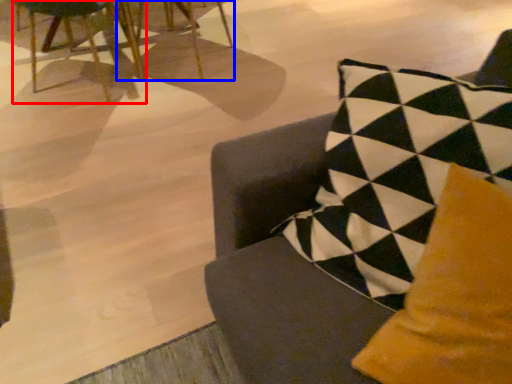
Question: Which object appears closest to the camera in this image, chair (highlighted by a red box) or chair (highlighted by a blue box)?

Choices:
 (A) chair
 (B) chair

Answer: (A)